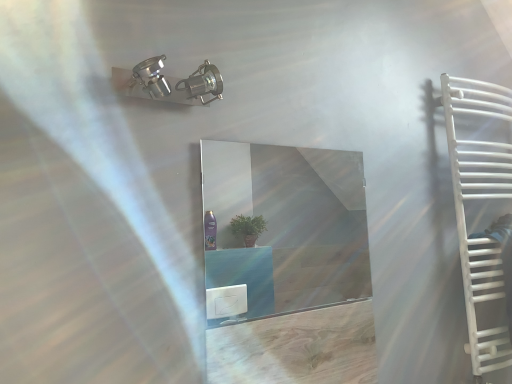
Question: Is white plastic stairs at right inside or outside of clear glass mirror at center?

Choices:
 (A) inside
 (B) outside

Answer: (B)

Question: Considering the positions of point (468, 314) and point (337, 185), is point (468, 314) closer or farther from the camera than point (337, 185)?

Choices:
 (A) closer
 (B) farther

Answer: (A)

Question: Based on their relative distances, which object is farther from the white plastic stairs at right?

Choices:
 (A) clear glass mirror at center
 (B) white matte towel rack at right

Answer: (A)

Question: Estimate the real-world distances between objects in this image. Which object is closer to the clear glass mirror at center?

Choices:
 (A) white matte towel rack at right
 (B) white plastic stairs at right

Answer: (A)